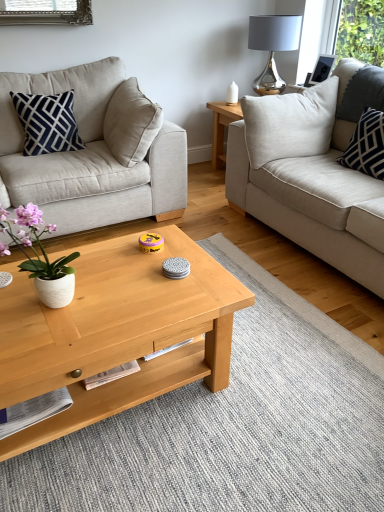
Locate an element on the screen. free space behind white ceramic pot at left is located at coordinates (77, 275).